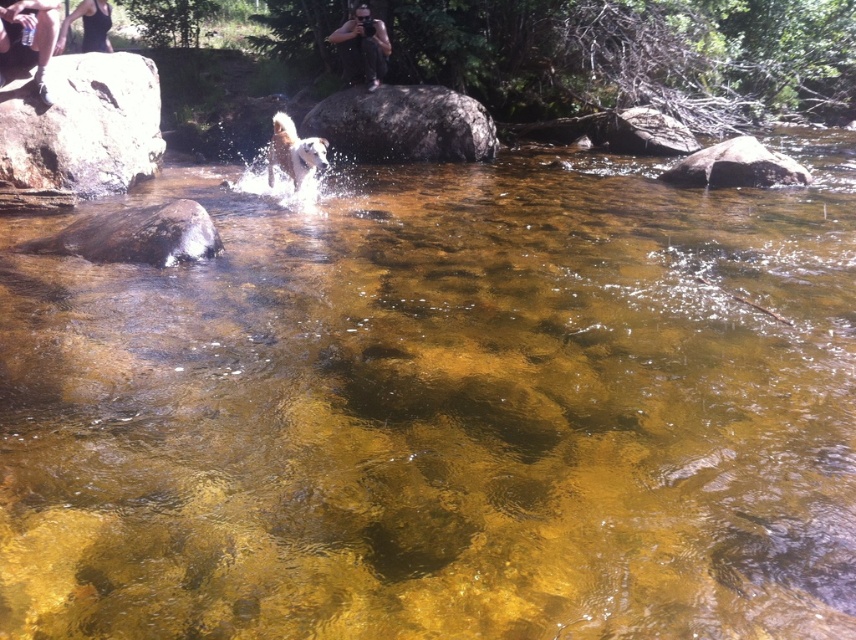
You are standing at the point with coordinates point (82, 125). What is the object located at that point?

The point (82, 125) corresponds to the smooth gray rock at upper left.

You are standing at the edge of the stream and notice two points marked in the image. Which point, point (149, 170) or point (388, 156), is closer to you?

Point (149, 170) is closer to the camera than point (388, 156).

Based on the photo, you are standing at the edge of the stream and want to throw a pebble to hit both the smooth gray rock at upper left and the gray textured rock at center. Which rock should you aim for first to hit them in the correct order?

You should aim for the smooth gray rock at upper left first because it is in front of the gray textured rock at center, so hitting it first ensures the pebble reaches the second one afterward.